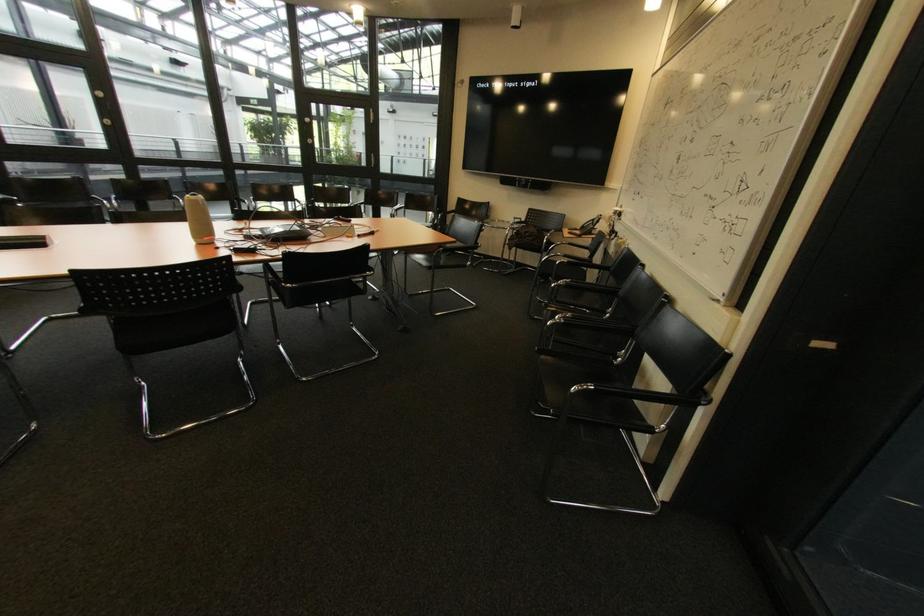
The image size is (924, 616). Describe the element at coordinates (574, 368) in the screenshot. I see `a black chair sitting surface` at that location.